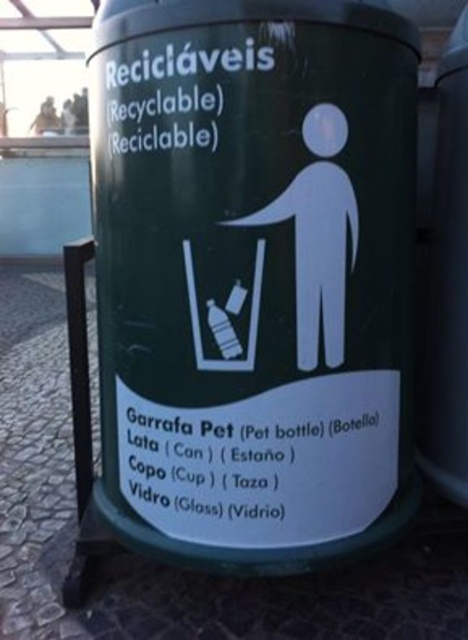
Question: Which of the following is the farthest from the observer?

Choices:
 (A) (411, 374)
 (B) (425, 224)

Answer: (B)

Question: Can you confirm if green matte recycling bin at center is positioned below green matte plastic recycling bin at center?

Choices:
 (A) yes
 (B) no

Answer: (A)

Question: Is green matte recycling bin at center behind green matte plastic recycling bin at center?

Choices:
 (A) yes
 (B) no

Answer: (B)

Question: Is green matte recycling bin at center bigger than green matte plastic recycling bin at center?

Choices:
 (A) yes
 (B) no

Answer: (A)